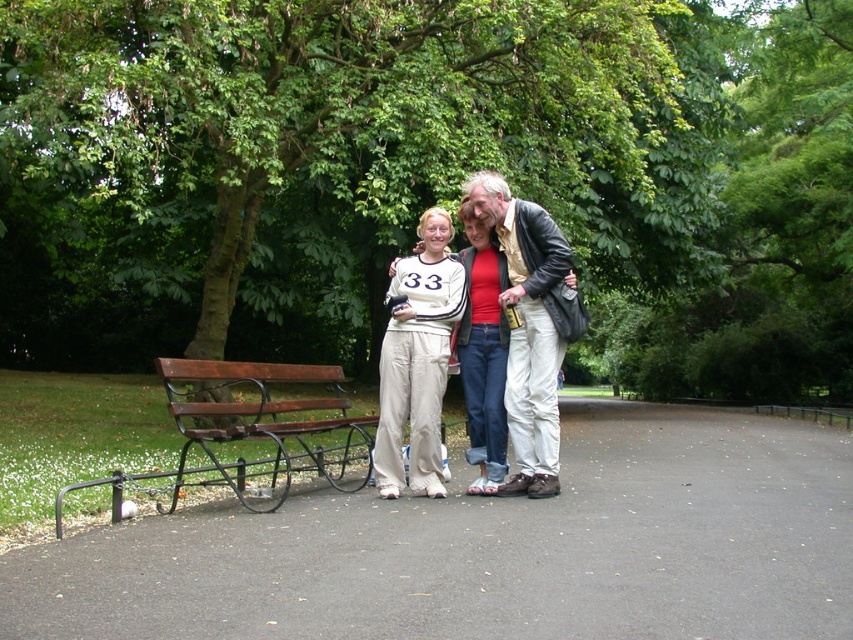
Who is positioned more to the left, green leafy tree at center or smooth asphalt path at center?

green leafy tree at center

The image size is (853, 640). What are the coordinates of `green leafy tree at center` in the screenshot? It's located at (323, 154).

Who is more forward, (x=444, y=54) or (x=149, y=620)?

Point (x=149, y=620) is in front.

At what (x,y) coordinates should I click in order to perform the action: click on green leafy tree at center. Please return your answer as a coordinate pair (x, y). The width and height of the screenshot is (853, 640). Looking at the image, I should click on (323, 154).

Is point (775, 636) closer to viewer compared to point (260, 368)?

Yes.

Consider the image. Which of these two, smooth asphalt path at center or brown wooden bench at left, stands taller?

brown wooden bench at left

Image resolution: width=853 pixels, height=640 pixels. I want to click on smooth asphalt path at center, so click(x=492, y=548).

You are a GUI agent. You are given a task and a screenshot of the screen. Output one action in this format:
    pyautogui.click(x=<x>, y=<y>)
    Task: Click on the smooth asphalt path at center
    Image resolution: width=853 pixels, height=640 pixels.
    Given the screenshot: What is the action you would take?
    pyautogui.click(x=492, y=548)

Does point (293, 268) come farther from viewer compared to point (434, 273)?

That is True.

Can you confirm if green leafy tree at center is smaller than white cotton pants at center?

No.

This screenshot has height=640, width=853. What do you see at coordinates (323, 154) in the screenshot?
I see `green leafy tree at center` at bounding box center [323, 154].

You are a GUI agent. You are given a task and a screenshot of the screen. Output one action in this format:
    pyautogui.click(x=<x>, y=<y>)
    Task: Click on the green leafy tree at center
    
    Given the screenshot: What is the action you would take?
    pyautogui.click(x=323, y=154)